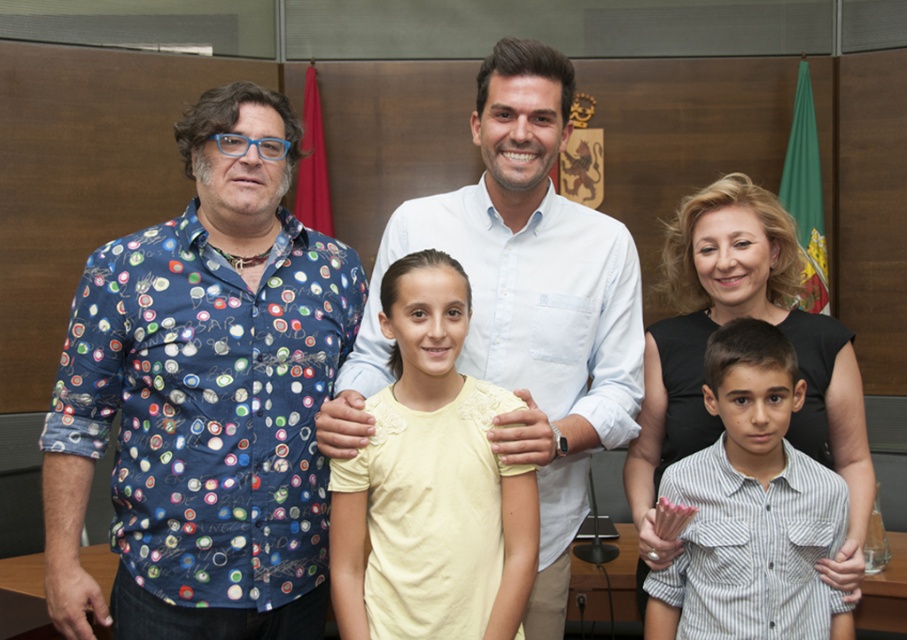
Based on the coordinates provided, which object is located at point (431, 484)?

The point (431, 484) corresponds to the yellow cotton shirt at center.